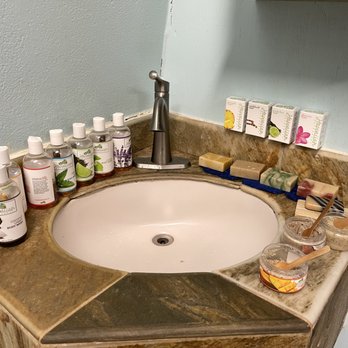
The width and height of the screenshot is (348, 348). I want to click on wooden spoons, so click(x=317, y=254), click(x=317, y=220).